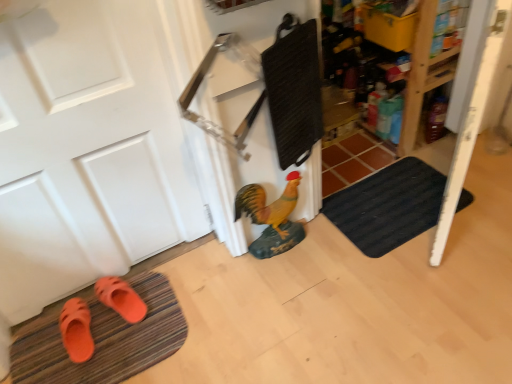
Locate an element on the screen. empty space that is to the right of orange rubber slipper at lower left, arranged as the 1th footwear when viewed from the right is located at coordinates (159, 308).